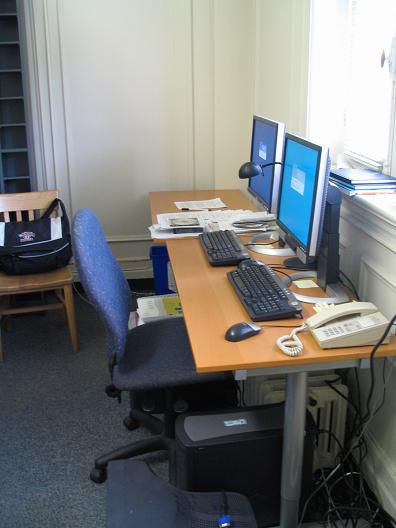
Locate an element on the screen. This screenshot has width=396, height=528. keyboard is located at coordinates (251, 285), (218, 240).